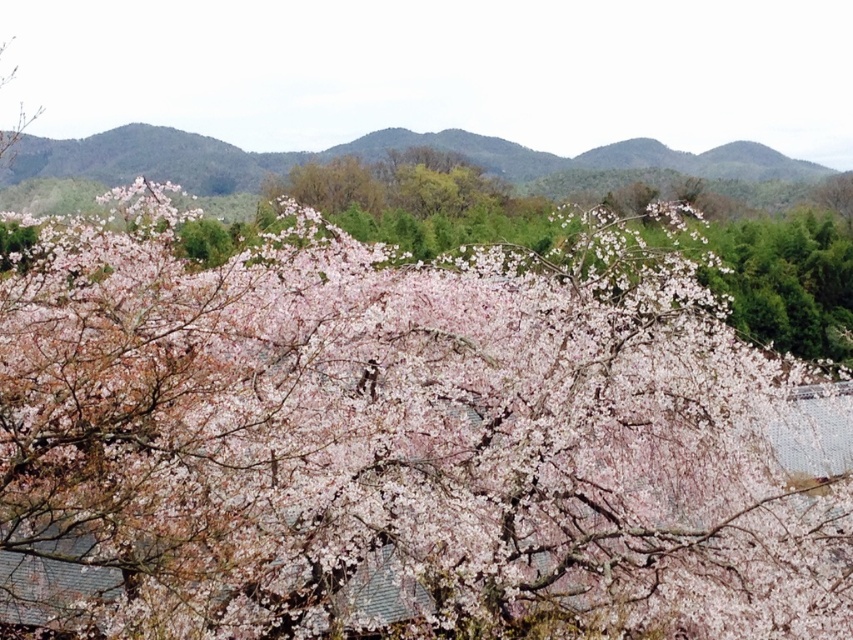
You are an artist planning to paint the cherry blossom scene. You have two brushes, one for the pink matte blossoms at center and another for the green leafy mountain at upper center. Which brush should you use first if you want to paint the larger object first?

The pink matte blossoms at center is larger in size than the green leafy mountain at upper center, so you should use the brush for the pink matte blossoms at center first.

You are an artist planning to paint the cherry blossom scene. You want to emphasize the depth by placing the pink matte blossoms at center and the green leafy mountain at upper center in a way that shows one is closer. Which object should you paint first to create this effect?

To create depth, you should paint the pink matte blossoms at center first since it is closer to the viewer than the green leafy mountain at upper center, allowing the mountain to be layered behind it.